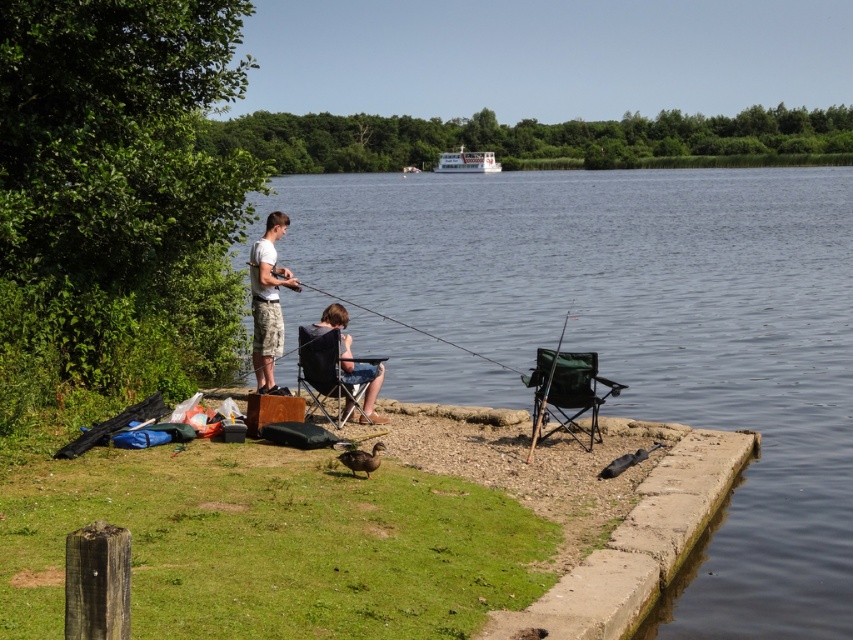
You are planning to cast your fishing line into the clear blue water at center using the green fabric fishing pole at center. Considering their sizes, which object would require more space to maneuver the fishing pole properly?

The clear blue water at center is larger in size than the green fabric fishing pole at center, so maneuvering the fishing pole would require more space due to the water being a larger area to target.

What is the 2D coordinate of the clear blue water at center?

The clear blue water at center is located at the 2D coordinate point of (643, 333).

You are planning to set up a tent between the matte black folding chair at center and the white plastic boat at upper center. Given that the tent requires a space of 1.2 meters in width, can the available area between them accommodate it?

The matte black folding chair at center has a lesser width compared to white plastic boat at upper center. However, the description does not provide specific measurements of the distance between them, so it is unclear if the space is sufficient for the tent requiring 1.2 meters in width.